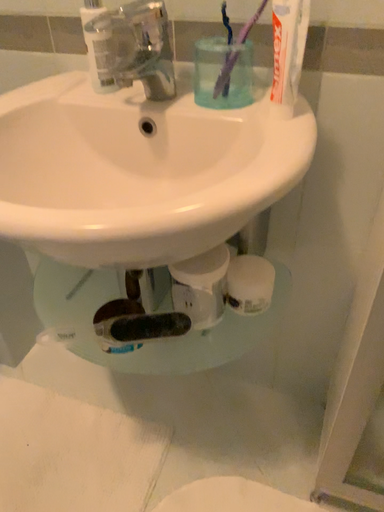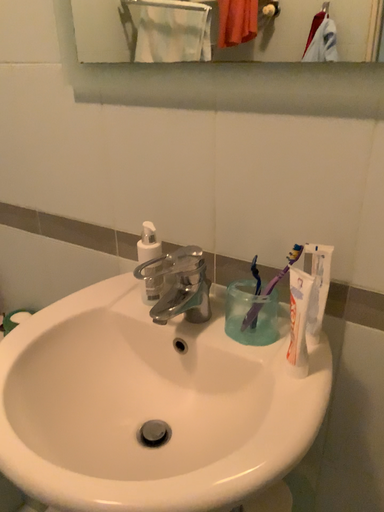
Question: Which way did the camera rotate in the video?

Choices:
 (A) rotated right
 (B) rotated left

Answer: (B)